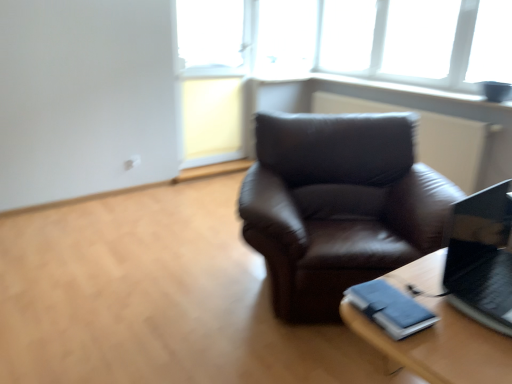
I want to click on vacant area located to the right-hand side of blue fabric binder at lower right, so (x=449, y=314).